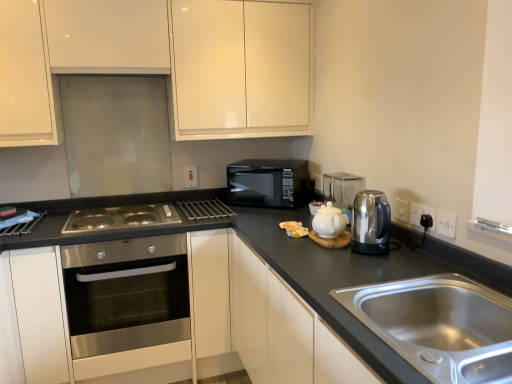
Find the location of a particular element. This screenshot has width=512, height=384. vacant space that's between white glossy tea pot at center and satin metallic kettle at right, marked as the first appliance in a front-to-back arrangement is located at coordinates (345, 258).